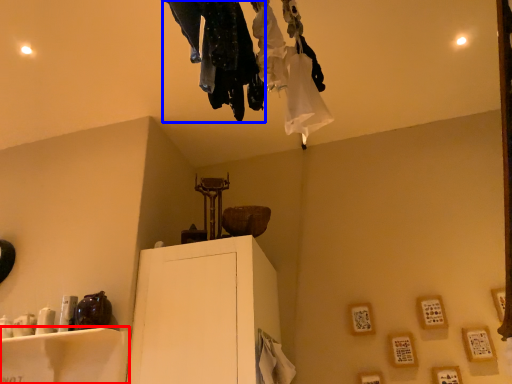
Question: Which point is further to the camera, furniture (highlighted by a red box) or clothing (highlighted by a blue box)?

Choices:
 (A) furniture
 (B) clothing

Answer: (A)